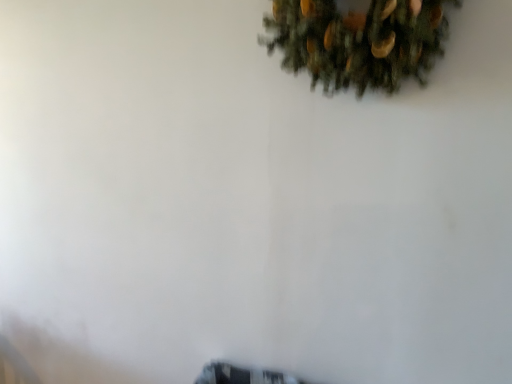
What are the coordinates of `green matte wreath at upper center` in the screenshot? It's located at (359, 41).

Describe the element at coordinates (359, 41) in the screenshot. I see `green matte wreath at upper center` at that location.

Find the location of a particular element. This screenshot has width=512, height=384. green matte wreath at upper center is located at coordinates (359, 41).